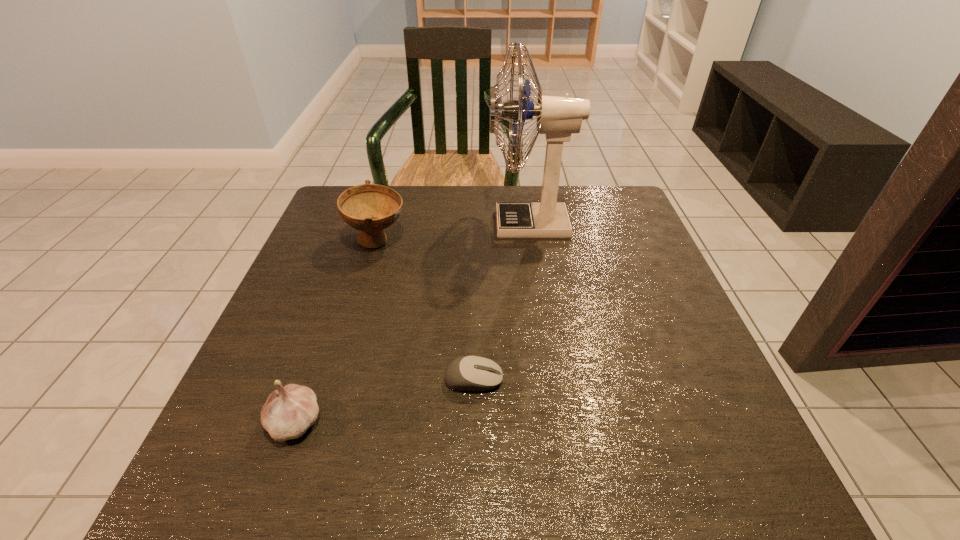
The image size is (960, 540). I want to click on free space located 0.090m on the back of the second shortest object, so pos(320,355).

What are the coordinates of `vacant area situated 0.340m on the wheel side of the shortest object` in the screenshot? It's located at (694, 380).

Where is `fan that is positioned at the far edge`? This screenshot has height=540, width=960. fan that is positioned at the far edge is located at coordinates (557, 117).

Find the location of a particular element. The height and width of the screenshot is (540, 960). soup bowl that is at the far edge is located at coordinates (370, 208).

Image resolution: width=960 pixels, height=540 pixels. I want to click on soup bowl located in the left edge section of the desktop, so click(x=370, y=208).

Where is `garlic that is at the left edge`? This screenshot has width=960, height=540. garlic that is at the left edge is located at coordinates (289, 411).

You are a GUI agent. You are given a task and a screenshot of the screen. Output one action in this format:
    pyautogui.click(x=<x>, y=<y>)
    Task: Click on the object positioned at the far left corner
    The width and height of the screenshot is (960, 540).
    Given the screenshot: What is the action you would take?
    pyautogui.click(x=370, y=208)

I want to click on free location at the far edge, so click(420, 230).

Locate an element on the screen. The width and height of the screenshot is (960, 540). vacant point at the near edge is located at coordinates (443, 511).

In the image, there is a desktop. What are the coordinates of `vacant space at the left edge` in the screenshot? It's located at (325, 382).